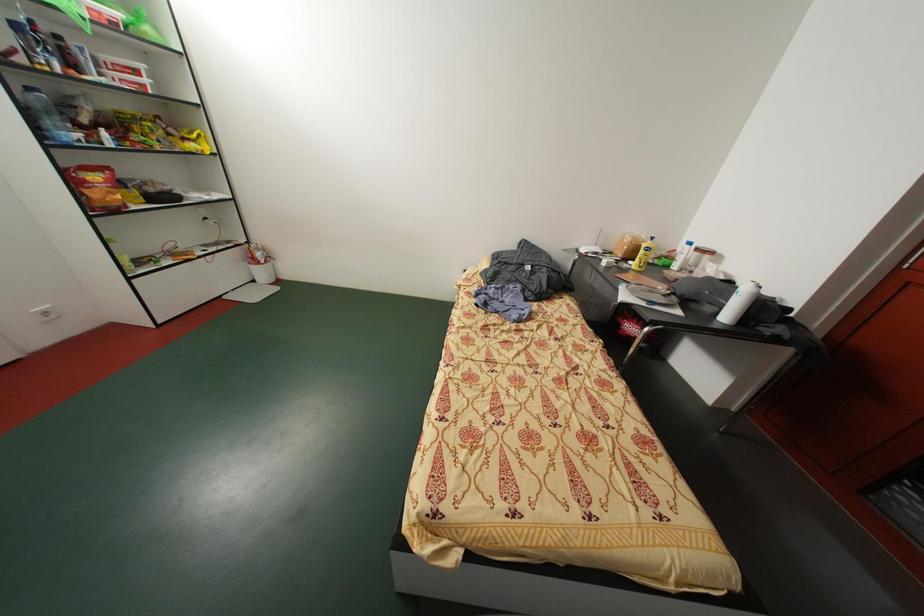
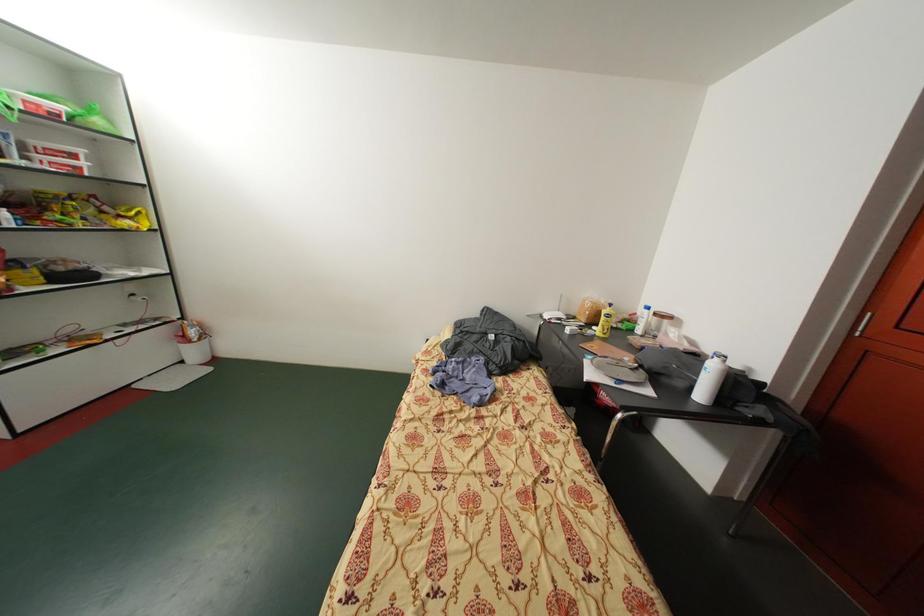
Question: Based on the continuous images, in which direction is the camera rotating? Reply with the corresponding letter.

Choices:
 (A) Left
 (B) Right
 (C) Up
 (D) Down

Answer: (C)